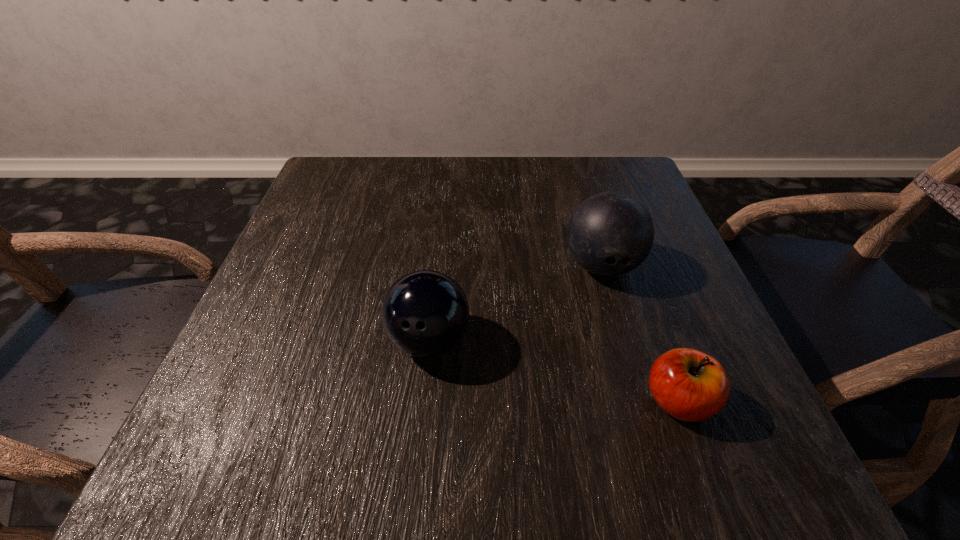
Find the location of a particular element. The width and height of the screenshot is (960, 540). apple that is at the right edge is located at coordinates (689, 385).

Locate an element on the screen. The height and width of the screenshot is (540, 960). object present at the near right corner is located at coordinates (689, 385).

The width and height of the screenshot is (960, 540). I want to click on free location at the far edge, so click(x=443, y=192).

Image resolution: width=960 pixels, height=540 pixels. In the image, there is a desktop. Find the location of `vacant space at the near edge`. vacant space at the near edge is located at coordinates (629, 440).

Image resolution: width=960 pixels, height=540 pixels. What are the coordinates of `vacant space at the left edge of the desktop` in the screenshot? It's located at (304, 278).

Find the location of `vacant space at the right edge of the desktop`. vacant space at the right edge of the desktop is located at coordinates (656, 260).

Where is `vacant space at the far left corner of the desktop`? Image resolution: width=960 pixels, height=540 pixels. vacant space at the far left corner of the desktop is located at coordinates (331, 202).

What are the coordinates of `free space at the near left corner of the desktop` in the screenshot? It's located at (262, 432).

Identify the location of vacant region at the far right corner. This screenshot has width=960, height=540. (626, 188).

At what (x,y) coordinates should I click in order to perform the action: click on free space between the shortest object and the farther bowling ball. Please return your answer as a coordinate pair (x, y). The image size is (960, 540). Looking at the image, I should click on (640, 333).